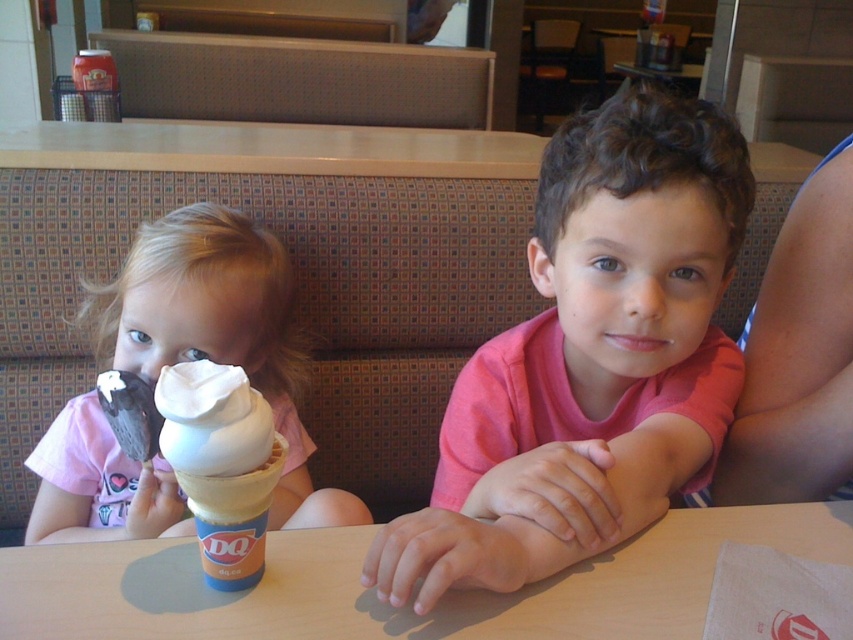
Two children are sitting at a table in a fast food restaurant. The child on the left is holding a chocolate ice cream cone and wearing a pink shirt. The child on the right is wearing a bright red shirt. A point labeled as point (167,280) is located between them. If the children want to place a small toy between them at this point, will they be able to reach it comfortably without moving their arms?

The children are 34.18 inches apart. Since the point (167,280) is between them, they can comfortably reach it without moving their arms as the distance is reasonable for typical arm lengths.

You are a photographer trying to decide which object to focus on for a closeup shot. The pink matte shirt at center and the matte white ice cream cone at left are both in your frame. Which object has a smaller width and would require less zoom to capture fully?

The pink matte shirt at center is thinner than the matte white ice cream cone at left, so it has a smaller width and would require less zoom to capture fully.

You are a photographer trying to capture a photo of the two children at the table. You need to decide which object, the pink matte shirt at center or the smooth wooden table at center, will be easier to focus on due to its texture. Which one would you choose?

The smooth wooden table at center has a more uniform texture compared to the pink matte shirt at center, making it easier to focus on.